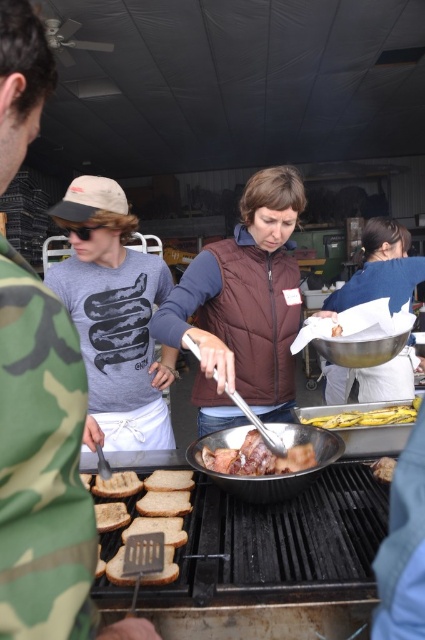
Is brown toasted bread at lower left thinner than white paper towel at center?

Yes.

Does brown toasted bread at lower left come behind white paper towel at center?

No, it is in front of white paper towel at center.

Image resolution: width=425 pixels, height=640 pixels. Find the location of `brown toasted bread at lower left`. brown toasted bread at lower left is located at coordinates (147, 525).

Measure the distance between brown puffy vest at center and yellow rubber gloves at center.

brown puffy vest at center is 15.48 inches from yellow rubber gloves at center.

Between brown puffy vest at center and yellow rubber gloves at center, which one appears on the right side from the viewer's perspective?

Positioned to the right is yellow rubber gloves at center.

Is point (210, 394) positioned behind point (402, 419)?

Yes, point (210, 394) is farther from viewer.

Locate an element on the screen. The image size is (425, 640). brown puffy vest at center is located at coordinates (243, 305).

Who is higher up, white paper towel at center or yellow rubber gloves at center?

Positioned higher is white paper towel at center.

Can you confirm if white paper towel at center is bigger than yellow rubber gloves at center?

Yes, white paper towel at center is bigger than yellow rubber gloves at center.

Between point (334, 310) and point (373, 410), which one is positioned behind?

The point (334, 310) is behind.

Find the location of a particular element. white paper towel at center is located at coordinates (380, 268).